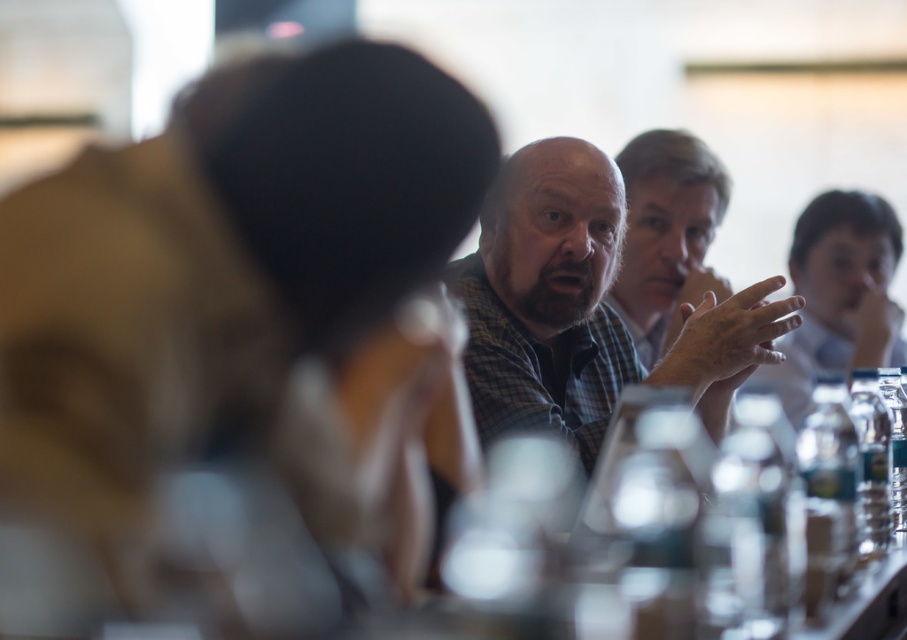
Question: Does plaid shirt at center appear on the right side of checkered fabric shirt at center?

Choices:
 (A) yes
 (B) no

Answer: (B)

Question: Among these objects, which one is farthest from the camera?

Choices:
 (A) plaid shirt at center
 (B) checkered fabric shirt at center

Answer: (B)

Question: Which of the following is the closest to the observer?

Choices:
 (A) (550, 305)
 (B) (671, 323)

Answer: (A)

Question: Does plaid shirt at center lie in front of checkered fabric shirt at center?

Choices:
 (A) no
 (B) yes

Answer: (B)

Question: Does plaid shirt at center appear on the right side of checkered fabric shirt at center?

Choices:
 (A) no
 (B) yes

Answer: (A)

Question: Among these points, which one is nearest to the camera?

Choices:
 (A) (504, 243)
 (B) (698, 140)

Answer: (A)